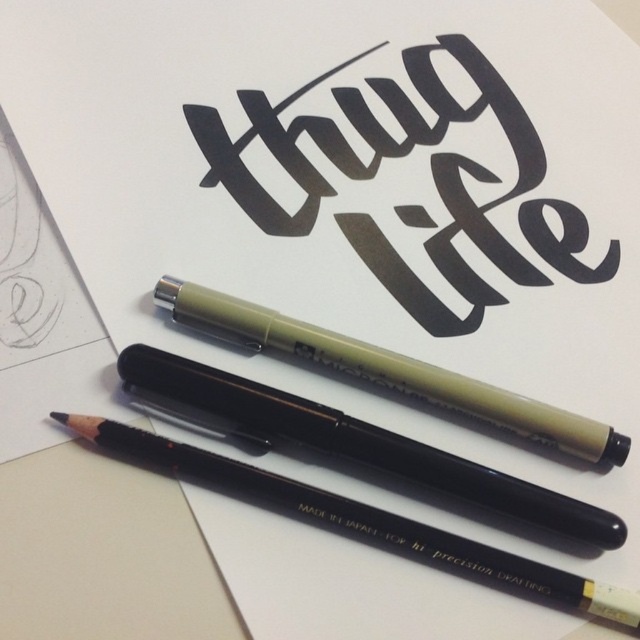
Question: Which of the following is the closest to the observer?

Choices:
 (A) (563, 228)
 (B) (384, 429)

Answer: (B)

Question: Which object appears farthest from the camera in this image?

Choices:
 (A) black matte pencil at center
 (B) matte olive pen at center
 (C) black matte pencil at lower center

Answer: (B)

Question: Which point is farther from the camera taking this photo?

Choices:
 (A) [577, 579]
 (B) [256, 420]

Answer: (B)

Question: Does black matte pencil at center have a smaller size compared to matte olive pen at center?

Choices:
 (A) no
 (B) yes

Answer: (A)

Question: Can you confirm if black calligraphy at center is thinner than black matte pencil at lower center?

Choices:
 (A) yes
 (B) no

Answer: (A)

Question: Is black calligraphy at center wider than black matte pencil at center?

Choices:
 (A) yes
 (B) no

Answer: (A)